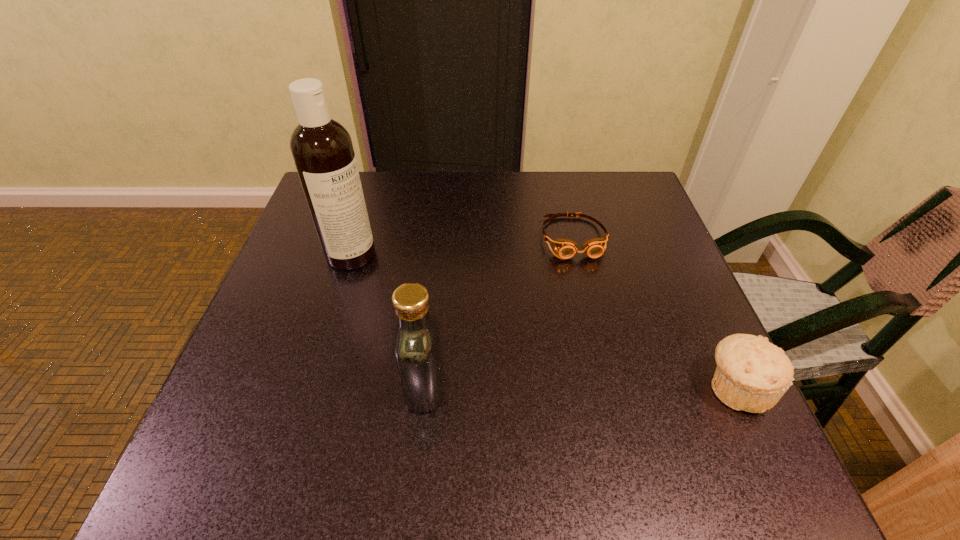
You are a GUI agent. You are given a task and a screenshot of the screen. Output one action in this format:
    pyautogui.click(x=<x>, y=<y>)
    Task: Click on the free space located 0.180m on the front-facing side of the third shortest object
    This screenshot has height=540, width=960.
    Given the screenshot: What is the action you would take?
    pyautogui.click(x=304, y=387)

I want to click on vacant region located on the left of the muffin, so click(x=493, y=388).

Identify the location of vacant space located on the label side of the tallest object. The width and height of the screenshot is (960, 540). (412, 287).

I want to click on free space located on the label side of the tallest object, so point(476,321).

The height and width of the screenshot is (540, 960). Identify the location of vacant space located 0.280m on the label side of the tallest object. (468, 317).

The width and height of the screenshot is (960, 540). Identify the location of free space located 0.300m with the lenses facing forward on the shortest object. (612, 374).

This screenshot has width=960, height=540. I want to click on vacant space located with the lenses facing forward on the shortest object, so click(626, 420).

You are a GUI agent. You are given a task and a screenshot of the screen. Output one action in this format:
    pyautogui.click(x=<x>, y=<y>)
    Task: Click on the vacant area located 0.180m with the lenses facing forward on the shortest object
    
    Given the screenshot: What is the action you would take?
    pyautogui.click(x=598, y=322)

Where is `object at the far edge`? object at the far edge is located at coordinates (565, 248).

At what (x,y) coordinates should I click in order to perform the action: click on vodka present at the near edge. Please return your answer as a coordinate pair (x, y). Looking at the image, I should click on (417, 349).